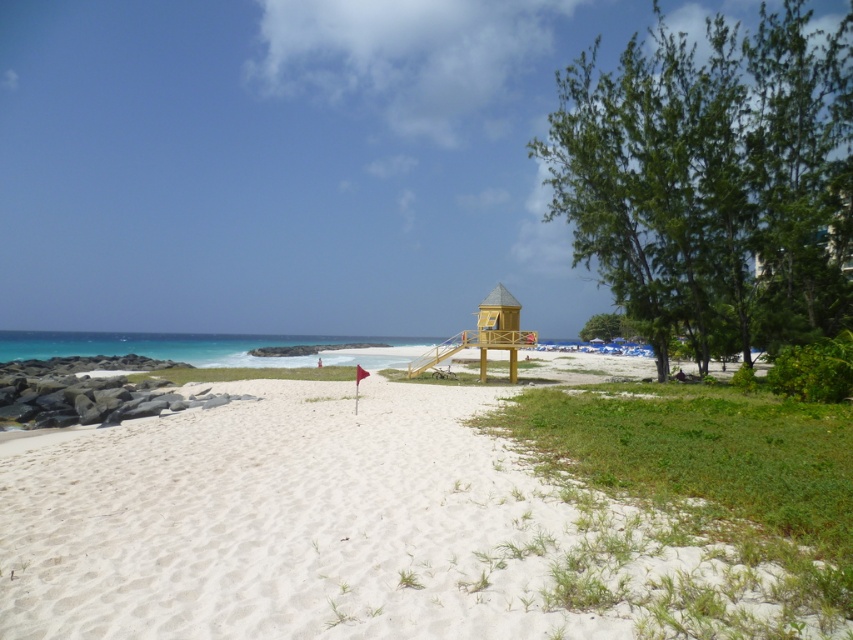
Question: Which object is the closest to the green leafy tree at center-right?

Choices:
 (A) white sandy beach at center
 (B) green leafy tree at right

Answer: (B)

Question: Estimate the real-world distances between objects in this image. Which object is closer to the green leafy tree at right?

Choices:
 (A) white sandy beach at center
 (B) green leafy tree at center-right

Answer: (A)

Question: Estimate the real-world distances between objects in this image. Which object is closer to the green leafy tree at center-right?

Choices:
 (A) white sandy beach at center
 (B) green leafy tree at right

Answer: (B)

Question: Considering the relative positions of white sandy beach at center and green leafy tree at right in the image provided, where is white sandy beach at center located with respect to green leafy tree at right?

Choices:
 (A) below
 (B) above

Answer: (A)

Question: Does white sandy beach at center appear on the right side of green leafy tree at center-right?

Choices:
 (A) no
 (B) yes

Answer: (A)

Question: Does white sandy beach at center appear on the left side of green leafy tree at center-right?

Choices:
 (A) no
 (B) yes

Answer: (B)